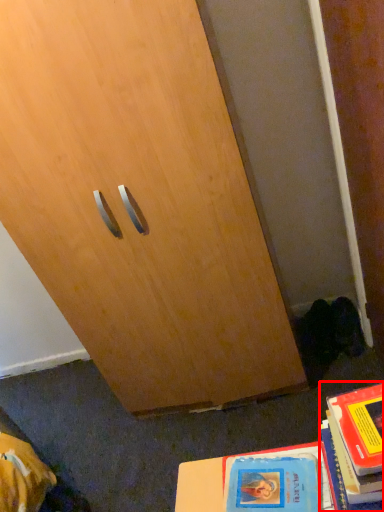
Question: Where is book (annotated by the red box) located in relation to book in the image?

Choices:
 (A) right
 (B) left

Answer: (A)